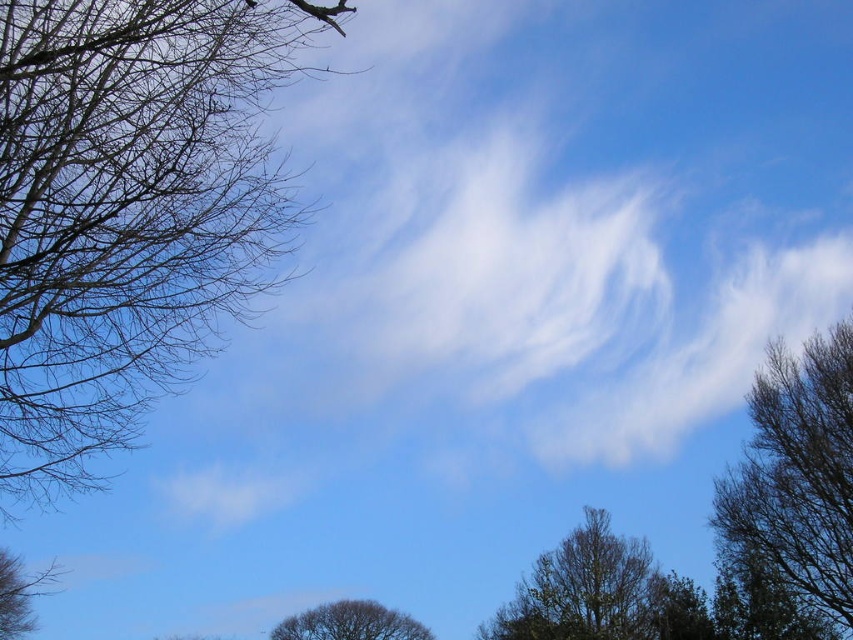
Question: Among these objects, which one is nearest to the camera?

Choices:
 (A) brown/dry branches at upper left
 (B) brown textured tree at right

Answer: (A)

Question: Is brown textured tree at right bigger than brown leafless branch at lower left?

Choices:
 (A) no
 (B) yes

Answer: (A)

Question: Which point is farther to the camera?

Choices:
 (A) brown leafless branch at lower left
 (B) brown textured tree at lower center

Answer: (B)

Question: Estimate the real-world distances between objects in this image. Which object is closer to the brown textured tree at right?

Choices:
 (A) brown leafless branch at lower left
 (B) brown textured tree at lower center

Answer: (B)

Question: Is brown textured tree at lower center positioned before brown leafless branch at lower left?

Choices:
 (A) yes
 (B) no

Answer: (B)

Question: Does brown/dry branches at upper left have a smaller size compared to brown textured tree at lower center?

Choices:
 (A) no
 (B) yes

Answer: (A)